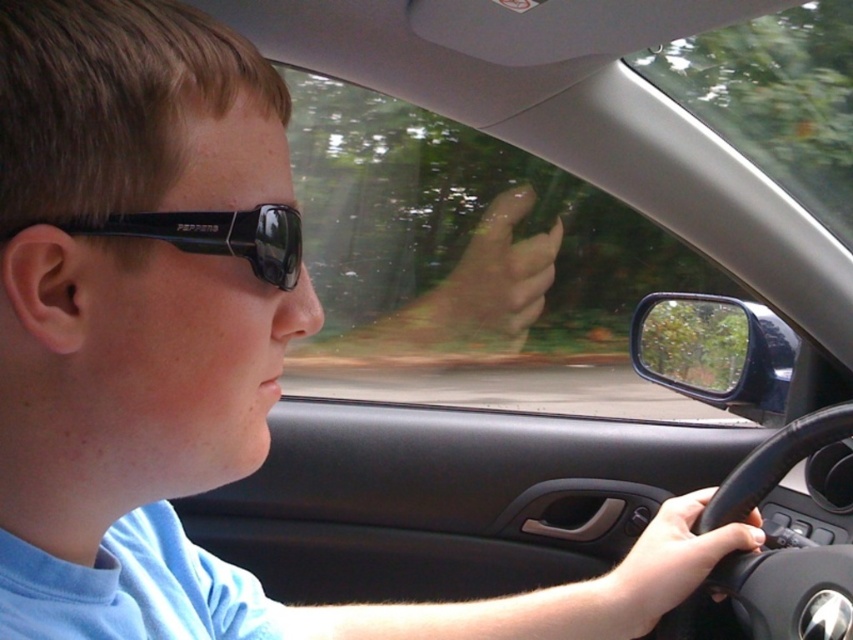
Identify the location of black matte sunglasses at upper left. The image size is (853, 640). (218, 236).

Which is above, black matte sunglasses at upper left or black leather steering wheel at lower right?

black matte sunglasses at upper left is above.

Where is `black matte sunglasses at upper left`? black matte sunglasses at upper left is located at coordinates 218,236.

Identify the location of black matte sunglasses at upper left. The width and height of the screenshot is (853, 640). (218, 236).